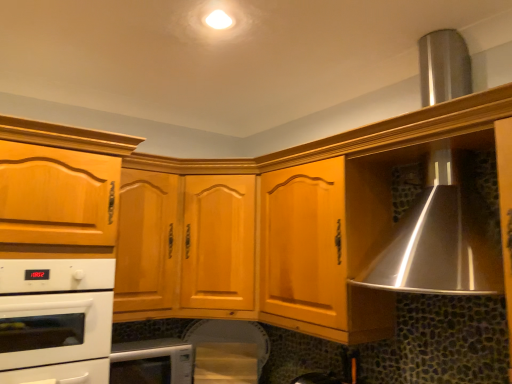
Question: Considering the relative positions of white glossy microwave at lower center, which is the first home appliance from bottom to top, and matte wood cabinet at left, the first cabinetry positioned from the left, in the image provided, is white glossy microwave at lower center, which is the first home appliance from bottom to top, to the right of matte wood cabinet at left, the first cabinetry positioned from the left, from the viewer's perspective?

Choices:
 (A) yes
 (B) no

Answer: (A)

Question: Can you confirm if white glossy microwave at lower center, which is the first home appliance from bottom to top, is thinner than matte wood cabinet at left, acting as the second cabinetry starting from the right?

Choices:
 (A) no
 (B) yes

Answer: (B)

Question: Considering the relative positions of white glossy microwave at lower center, which is the first home appliance from bottom to top, and matte wood cabinet at left, acting as the second cabinetry starting from the right, in the image provided, is white glossy microwave at lower center, which is the first home appliance from bottom to top, to the left of matte wood cabinet at left, acting as the second cabinetry starting from the right, from the viewer's perspective?

Choices:
 (A) no
 (B) yes

Answer: (A)

Question: Is white glossy microwave at lower center, the second home appliance positioned from the top, wider than matte wood cabinet at left, the first cabinetry positioned from the left?

Choices:
 (A) no
 (B) yes

Answer: (A)

Question: From a real-world perspective, is white glossy microwave at lower center, which is the first home appliance from bottom to top, over matte wood cabinet at left, the first cabinetry positioned from the left?

Choices:
 (A) yes
 (B) no

Answer: (B)

Question: Considering the positions of white glossy microwave at lower center, which is the first home appliance from bottom to top, and white glossy oven at lower left, positioned as the 1th home appliance in top-to-bottom order, in the image, is white glossy microwave at lower center, which is the first home appliance from bottom to top, bigger or smaller than white glossy oven at lower left, positioned as the 1th home appliance in top-to-bottom order,?

Choices:
 (A) small
 (B) big

Answer: (A)

Question: Is white glossy microwave at lower center, which is the first home appliance from bottom to top, wider or thinner than white glossy oven at lower left, which is the second home appliance from bottom to top?

Choices:
 (A) wide
 (B) thin

Answer: (B)

Question: Is white glossy microwave at lower center, which is the first home appliance from bottom to top, in front of or behind white glossy oven at lower left, which is the second home appliance from bottom to top, in the image?

Choices:
 (A) behind
 (B) front

Answer: (A)

Question: From their relative heights in the image, would you say white glossy microwave at lower center, which is the first home appliance from bottom to top, is taller or shorter than white glossy oven at lower left, positioned as the 1th home appliance in top-to-bottom order?

Choices:
 (A) tall
 (B) short

Answer: (B)

Question: Is point (93, 304) closer or farther from the camera than point (69, 162)?

Choices:
 (A) closer
 (B) farther

Answer: (A)

Question: In terms of width, does white glossy oven at lower left, which is the second home appliance from bottom to top, look wider or thinner when compared to matte wood cabinet at left, the first cabinetry positioned from the left?

Choices:
 (A) thin
 (B) wide

Answer: (A)

Question: From the image's perspective, is white glossy oven at lower left, positioned as the 1th home appliance in top-to-bottom order, located above or below matte wood cabinet at left, the first cabinetry positioned from the left?

Choices:
 (A) below
 (B) above

Answer: (A)

Question: Looking at the image, does white glossy oven at lower left, positioned as the 1th home appliance in top-to-bottom order, seem bigger or smaller compared to matte wood cabinet at left, acting as the second cabinetry starting from the right?

Choices:
 (A) big
 (B) small

Answer: (B)

Question: Is light brown wood cabinet at center, which appears as the second cabinetry when viewed from the left, taller or shorter than matte wood cabinet at left, the first cabinetry positioned from the left?

Choices:
 (A) tall
 (B) short

Answer: (B)

Question: Is light brown wood cabinet at center, which appears as the second cabinetry when viewed from the left, wider or thinner than matte wood cabinet at left, the first cabinetry positioned from the left?

Choices:
 (A) thin
 (B) wide

Answer: (A)